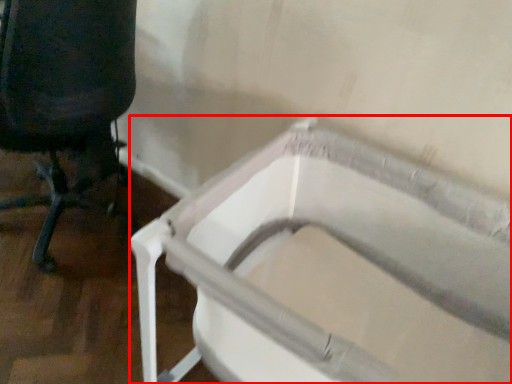
Question: From the image, what is the correct spatial relationship of bath (annotated by the red box) in relation to chair?

Choices:
 (A) right
 (B) left

Answer: (A)